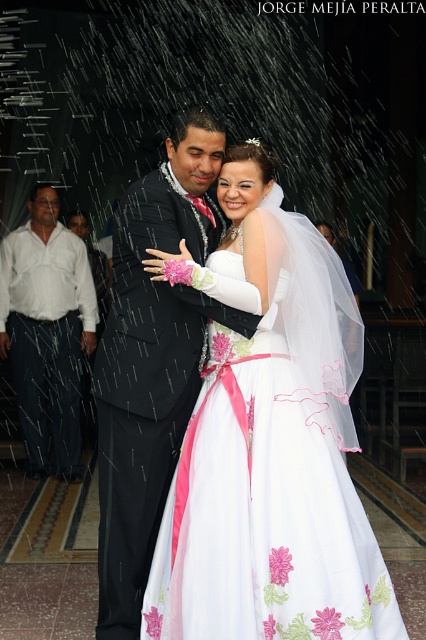
Question: Which of the following is the farthest from the observer?

Choices:
 (A) white satin dress at center
 (B) matte black suit at center

Answer: (B)

Question: Does white satin dress at center appear on the left side of matte black suit at center?

Choices:
 (A) yes
 (B) no

Answer: (B)

Question: From the image, what is the correct spatial relationship of white satin dress at center in relation to white cotton shirt at left?

Choices:
 (A) left
 (B) right

Answer: (B)

Question: Among these points, which one is farthest from the camera?

Choices:
 (A) (37, 308)
 (B) (207, 596)

Answer: (A)

Question: Which point is closer to the camera taking this photo?

Choices:
 (A) (6, 236)
 (B) (169, 371)

Answer: (B)

Question: Is white satin dress at center to the right of white cotton shirt at left from the viewer's perspective?

Choices:
 (A) yes
 (B) no

Answer: (A)